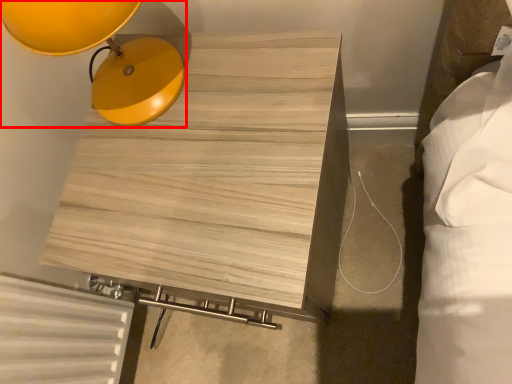
Question: From the image's perspective, where is lamp (annotated by the red box) located relative to furniture?

Choices:
 (A) above
 (B) below

Answer: (A)